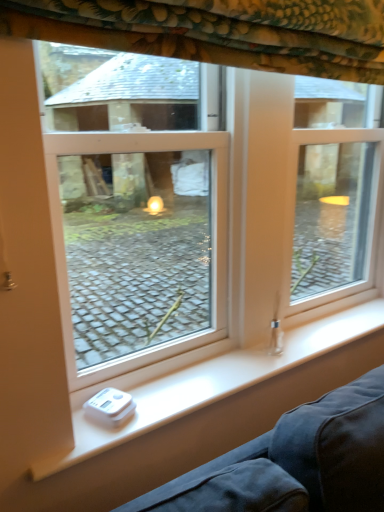
Question: Can you confirm if white plastic scale at lower left is positioned to the right of floral fabric curtain at upper center?

Choices:
 (A) yes
 (B) no

Answer: (A)

Question: Is white plastic scale at lower left closer to the viewer compared to floral fabric curtain at upper center?

Choices:
 (A) yes
 (B) no

Answer: (B)

Question: Is white plastic scale at lower left looking in the opposite direction of floral fabric curtain at upper center?

Choices:
 (A) no
 (B) yes

Answer: (A)

Question: Is white plastic scale at lower left facing towards floral fabric curtain at upper center?

Choices:
 (A) yes
 (B) no

Answer: (B)

Question: Could floral fabric curtain at upper center be considered to be inside white plastic scale at lower left?

Choices:
 (A) yes
 (B) no

Answer: (B)

Question: Does white plastic scale at lower left have a greater height compared to floral fabric curtain at upper center?

Choices:
 (A) yes
 (B) no

Answer: (B)

Question: Can you confirm if white plastic window at center is positioned to the left of floral fabric curtain at upper center?

Choices:
 (A) yes
 (B) no

Answer: (B)

Question: From the image's perspective, is white plastic window at center on top of floral fabric curtain at upper center?

Choices:
 (A) yes
 (B) no

Answer: (B)

Question: Considering the relative positions of white plastic window at center and floral fabric curtain at upper center in the image provided, is white plastic window at center to the right of floral fabric curtain at upper center from the viewer's perspective?

Choices:
 (A) no
 (B) yes

Answer: (B)

Question: Does white plastic window at center come behind floral fabric curtain at upper center?

Choices:
 (A) no
 (B) yes

Answer: (B)

Question: Is white plastic window at center facing away from floral fabric curtain at upper center?

Choices:
 (A) yes
 (B) no

Answer: (B)

Question: From a real-world perspective, is white plastic window at center on top of floral fabric curtain at upper center?

Choices:
 (A) no
 (B) yes

Answer: (A)

Question: Is white plastic scale at lower left inside white plastic window at center?

Choices:
 (A) no
 (B) yes

Answer: (A)